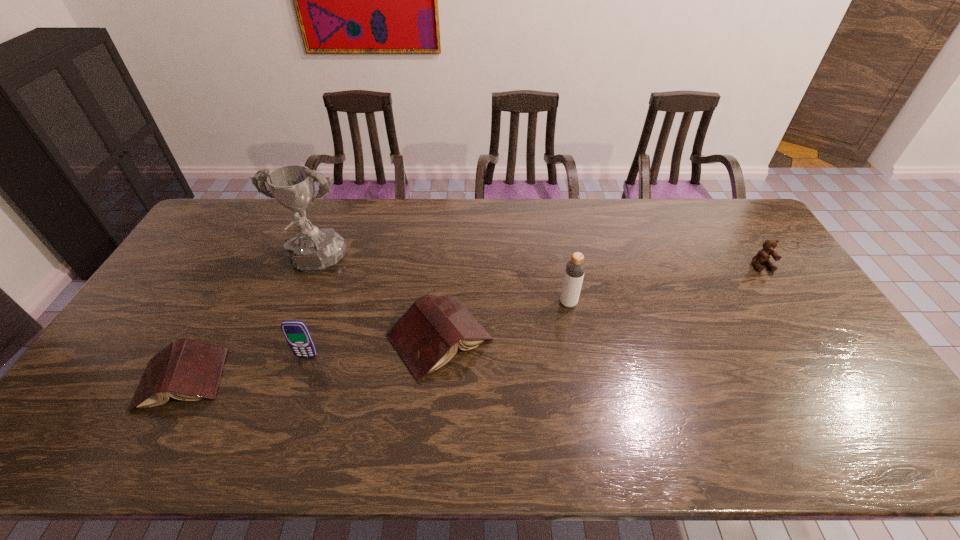
In order to click on vacant space located on the left of the third object from right to left in this screenshot , I will do `click(286, 338)`.

You are a GUI agent. You are given a task and a screenshot of the screen. Output one action in this format:
    pyautogui.click(x=<x>, y=<y>)
    Task: Click on the vacant space positioned on the face of the rightmost object
    The height and width of the screenshot is (540, 960).
    Given the screenshot: What is the action you would take?
    pyautogui.click(x=787, y=305)

Where is `free location located on the side with emblem of the tallest object`? The width and height of the screenshot is (960, 540). free location located on the side with emblem of the tallest object is located at coordinates (297, 309).

Where is `vacant space situated 0.350m on the back of the bottle`? vacant space situated 0.350m on the back of the bottle is located at coordinates (554, 225).

Where is `vacant space located 0.110m on the front-facing side of the cellular telephone`? The image size is (960, 540). vacant space located 0.110m on the front-facing side of the cellular telephone is located at coordinates (294, 395).

Identify the location of object located at the left edge. (188, 370).

I want to click on object that is positioned at the right edge, so click(763, 256).

I want to click on object located at the near left corner, so (188, 370).

You are a GUI agent. You are given a task and a screenshot of the screen. Output one action in this format:
    pyautogui.click(x=<x>, y=<y>)
    Task: Click on the free location at the far edge of the desktop
    This screenshot has width=960, height=540.
    Given the screenshot: What is the action you would take?
    pyautogui.click(x=598, y=203)

Image resolution: width=960 pixels, height=540 pixels. In the image, there is a desktop. Find the location of `free region at the near edge`. free region at the near edge is located at coordinates (769, 389).